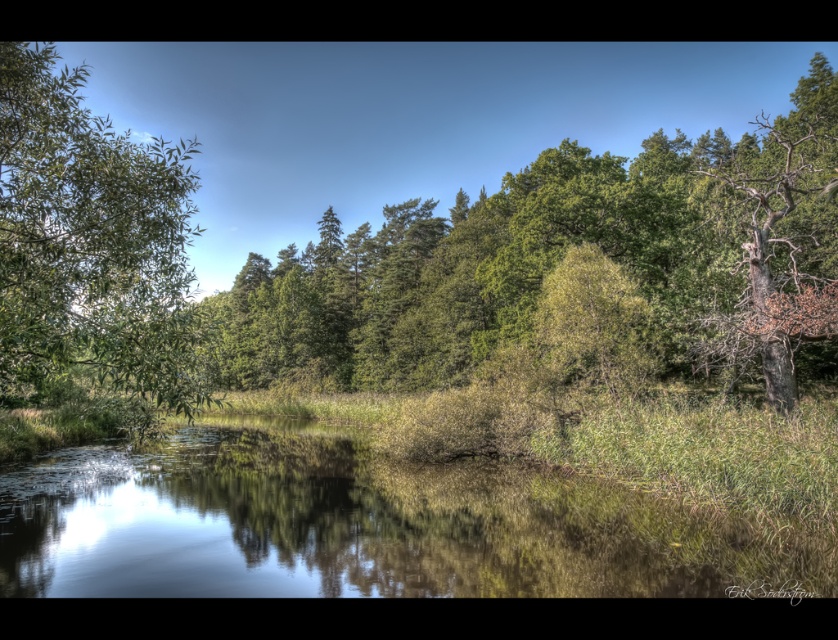
You are standing on the path behind the green leafy tree at center and want to walk to the green grassy lake at center. Which direction should you walk to reach the lake?

You should walk forward because the green leafy tree at center is behind the green grassy lake at center, meaning the lake is in front of the tree. Since you are behind the tree, moving forward would take you towards the lake.

You are standing in the serene landscape and want to know how far the point at coordinates [252,333] is from your current position. Can you determine the distance?

The point at coordinates [252,333] is 84.69 meters away from the viewer.